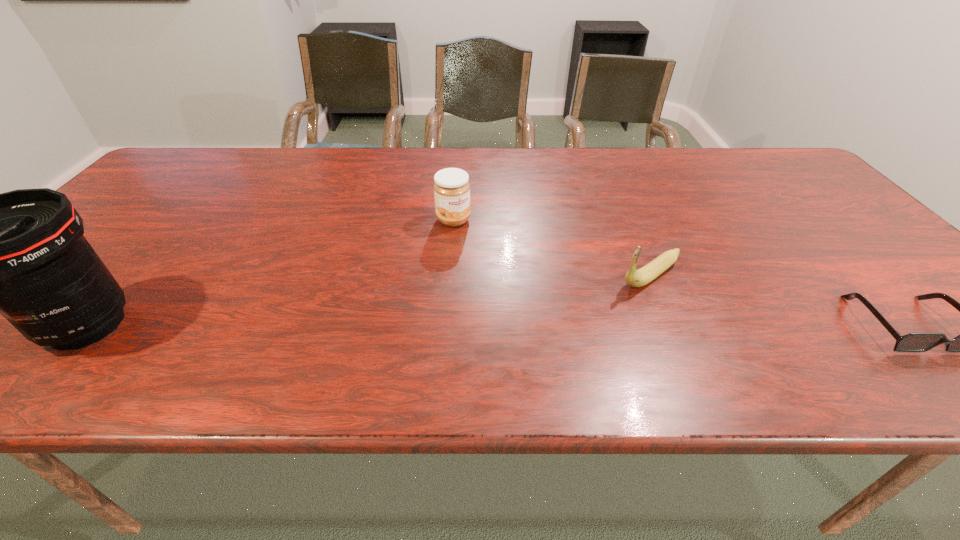
You are a GUI agent. You are given a task and a screenshot of the screen. Output one action in this format:
    pyautogui.click(x=<x>, y=<y>)
    Task: Click on the vacant space on the desktop that is between the tallest object and the shortest object and is positioned on the front label of the farthest object
    
    Given the screenshot: What is the action you would take?
    pyautogui.click(x=555, y=325)

You are a GUI agent. You are given a task and a screenshot of the screen. Output one action in this format:
    pyautogui.click(x=<x>, y=<y>)
    Task: Click on the vacant space on the desktop that is between the telephoto lens and the rightmost object and is positioned at the stem of the banana
    Image resolution: width=960 pixels, height=540 pixels.
    Given the screenshot: What is the action you would take?
    pyautogui.click(x=577, y=325)